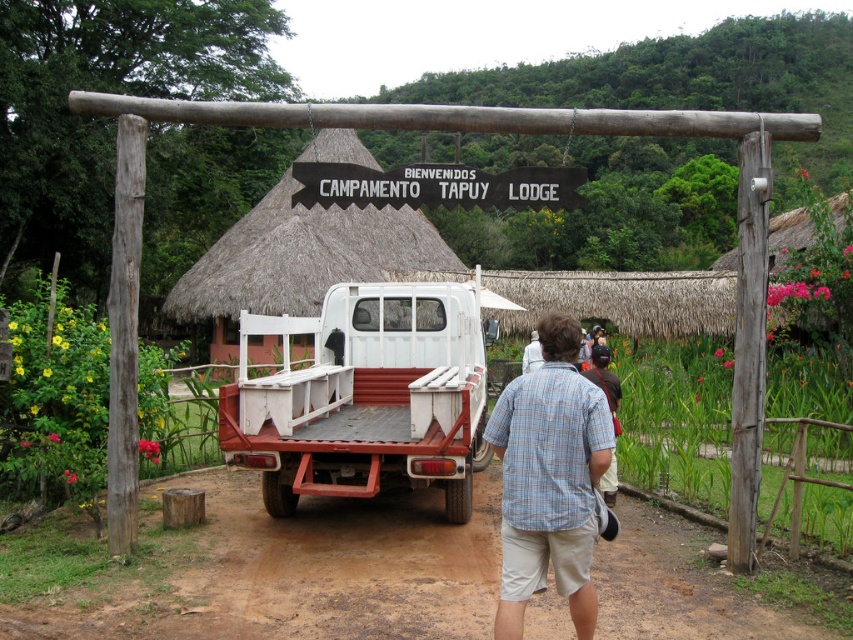
Is the position of brown dirt track at center more distant than that of blue plaid shirt at center?

Yes, it is behind blue plaid shirt at center.

Can you confirm if brown dirt track at center is positioned to the right of blue plaid shirt at center?

In fact, brown dirt track at center is to the left of blue plaid shirt at center.

Where is `brown dirt track at center`? brown dirt track at center is located at coordinates (262, 570).

Locate an element on the screen. Image resolution: width=853 pixels, height=640 pixels. brown dirt track at center is located at coordinates (262, 570).

Describe the element at coordinates (364, 396) in the screenshot. I see `white matte truck at center` at that location.

Is point (270, 504) behind point (403, 214)?

No.

I want to click on white matte truck at center, so click(x=364, y=396).

Who is more distant from viewer, (296, 403) or (519, 524)?

Point (296, 403)

Between white matte truck at center and blue plaid shirt at center, which one appears on the left side from the viewer's perspective?

white matte truck at center is more to the left.

Does point (320, 419) lie in front of point (596, 422)?

No.

Where is `white matte truck at center`? white matte truck at center is located at coordinates (364, 396).